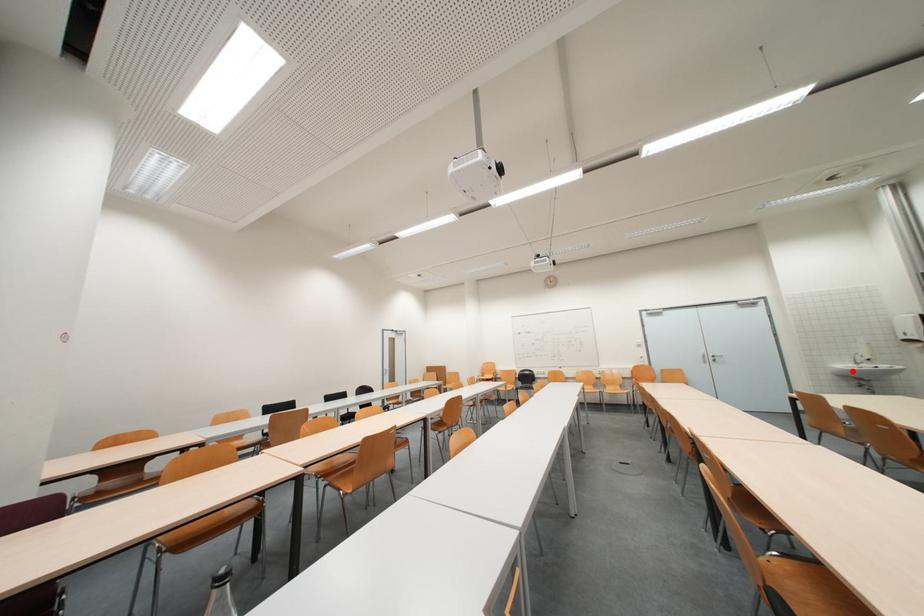
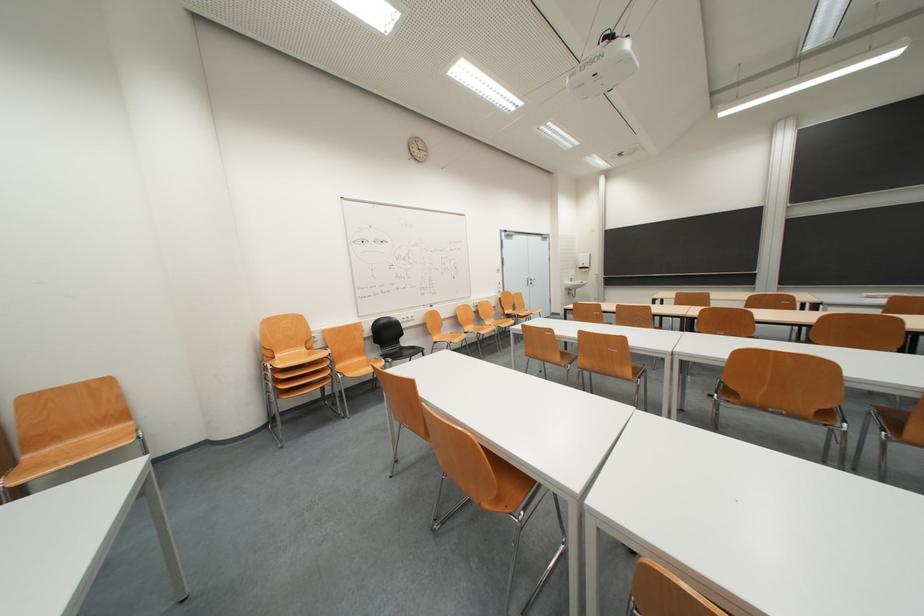
Where in the second image is the point corresponding to the highlighted location from the first image?

(575, 288)